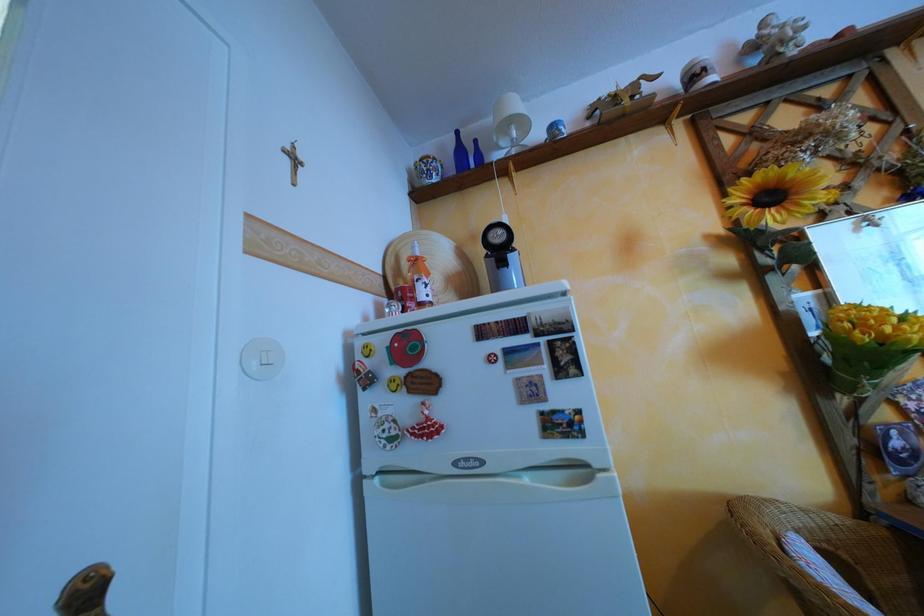
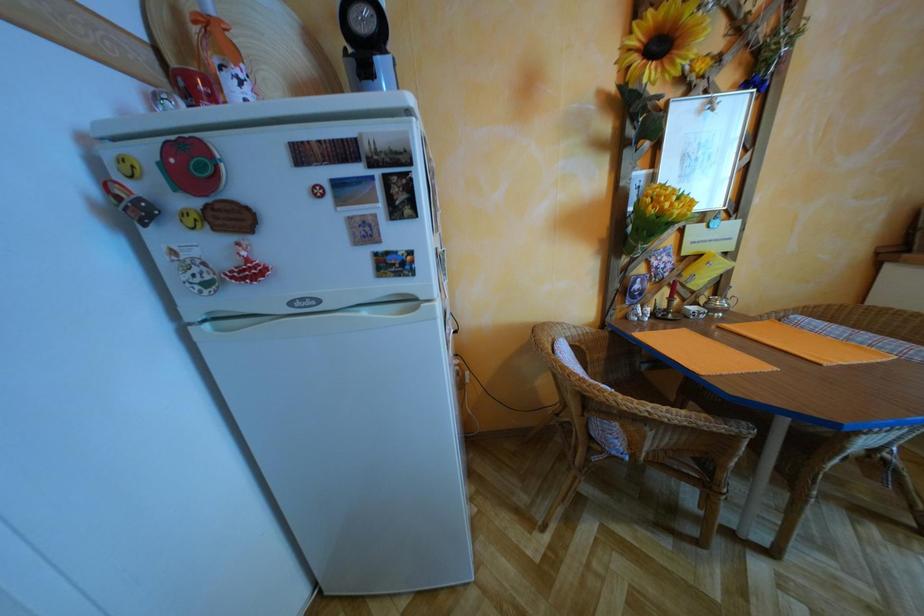
Based on the continuous images, in which direction is the camera rotating?

The camera rotated toward right-down.